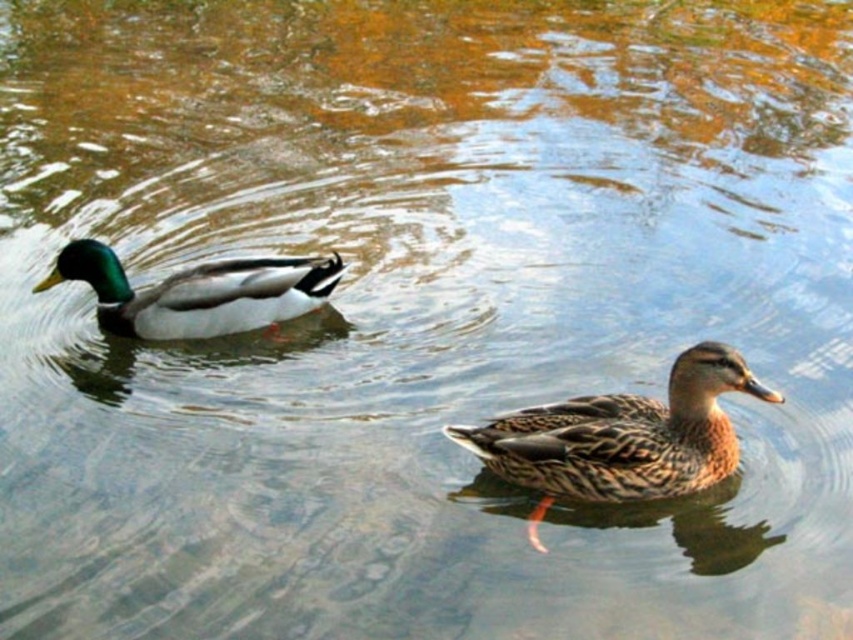
Is point (619, 464) farther from camera compared to point (202, 328)?

No, it is in front of (202, 328).

Is brown speckled duck at center shorter than shiny green and white duck at left?

In fact, brown speckled duck at center may be taller than shiny green and white duck at left.

Who is more distant from viewer, (550, 428) or (177, 324)?

The point (177, 324) is more distant.

The image size is (853, 640). In order to click on brown speckled duck at center in this screenshot , I will do `click(622, 436)`.